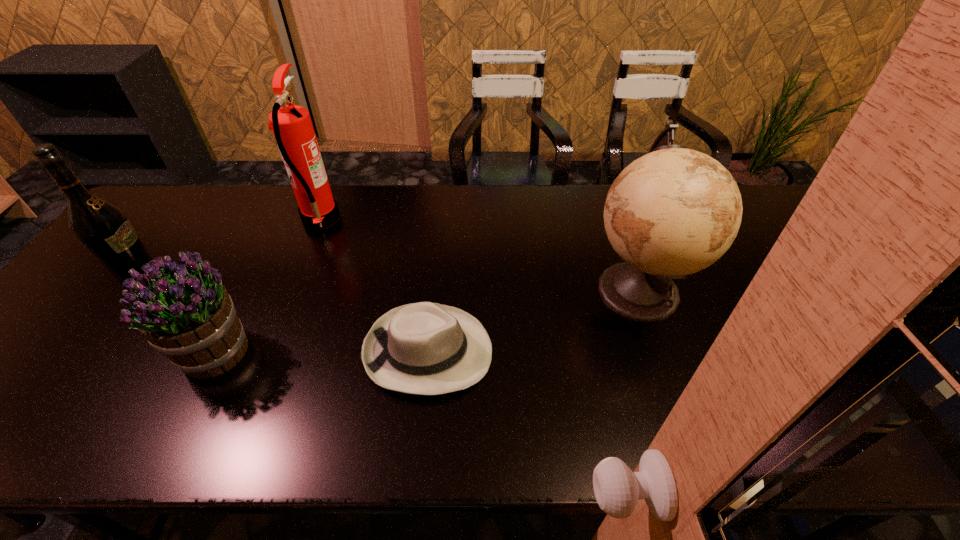
I want to click on free space between the farthest object and the leftmost object, so click(229, 246).

This screenshot has width=960, height=540. What are the coordinates of `free space between the globe and the wine bottle` in the screenshot? It's located at (388, 282).

Locate an element on the screen. free space between the second object from right to left and the fourth tallest object is located at coordinates (323, 352).

Find the location of `free space between the shortest object and the globe`. free space between the shortest object and the globe is located at coordinates (533, 320).

Locate an element on the screen. This screenshot has width=960, height=540. free space between the farthest object and the wine bottle is located at coordinates (229, 246).

Where is `free space between the fourth object from left to right and the globe`? free space between the fourth object from left to right and the globe is located at coordinates (533, 320).

I want to click on object that stands as the fourth closest to the rightmost object, so click(101, 226).

In order to click on object that is the second nearest to the wine bottle in this screenshot , I will do `click(291, 124)`.

Image resolution: width=960 pixels, height=540 pixels. I want to click on free space that satisfies the following two spatial constraints: 1. with the nozzle aimed from the fire extinguisher; 2. on the front side of the bouquet, so click(x=267, y=352).

Image resolution: width=960 pixels, height=540 pixels. I want to click on vacant space that satisfies the following two spatial constraints: 1. on the label of the leftmost object; 2. on the left side of the second shortest object, so click(80, 352).